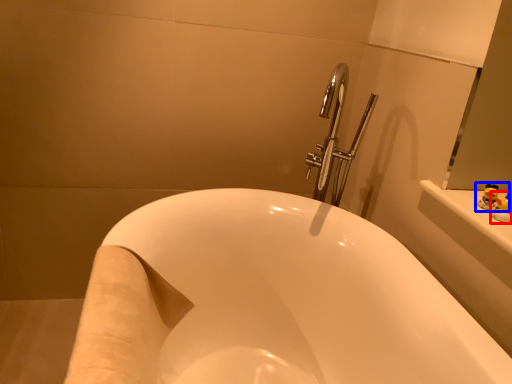
Question: Which point is closer to the camera, toy (highlighted by a red box) or toy (highlighted by a blue box)?

Choices:
 (A) toy
 (B) toy

Answer: (A)